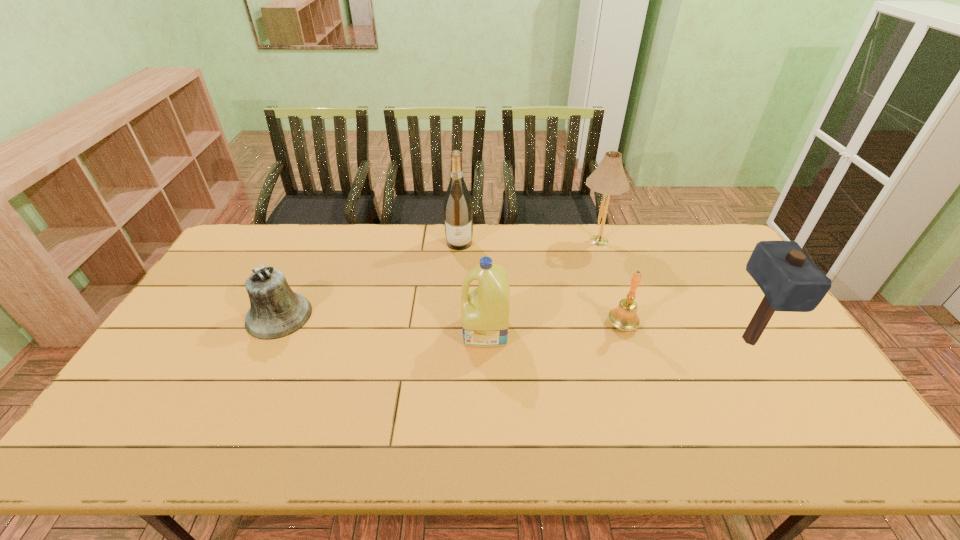
At what (x,y) coordinates should I click in order to perform the action: click on free region located on the label of the detergent. Please return your answer as a coordinate pair (x, y). Looking at the image, I should click on (334, 332).

The height and width of the screenshot is (540, 960). Find the location of `free space located on the label of the detergent`. free space located on the label of the detergent is located at coordinates (348, 332).

The height and width of the screenshot is (540, 960). I want to click on vacant region located on the left of the right bell, so click(x=515, y=325).

Where is `vacant space located on the front of the left bell`? The width and height of the screenshot is (960, 540). vacant space located on the front of the left bell is located at coordinates (245, 387).

Where is `lampshade located in the far edge section of the desktop`? Image resolution: width=960 pixels, height=540 pixels. lampshade located in the far edge section of the desktop is located at coordinates (608, 178).

Identify the location of wine bottle that is positioned at the far edge. The height and width of the screenshot is (540, 960). (458, 213).

Where is `object that is positioned at the right edge`? Image resolution: width=960 pixels, height=540 pixels. object that is positioned at the right edge is located at coordinates (789, 280).

Find the location of a particular element. The height and width of the screenshot is (540, 960). vacant space at the far edge is located at coordinates (481, 226).

Locate an element on the screen. The width and height of the screenshot is (960, 540). free space at the near edge of the desktop is located at coordinates (458, 453).

The height and width of the screenshot is (540, 960). In the image, there is a desktop. Find the location of `free space at the left edge`. free space at the left edge is located at coordinates (152, 379).